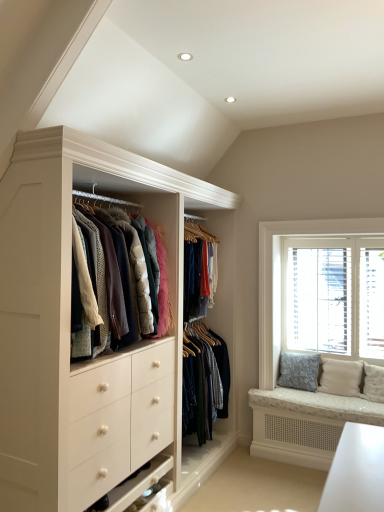
Question: Should I look upward or downward to see white wooden window at right?

Choices:
 (A) up
 (B) down

Answer: (B)

Question: Is white wooden window at right not within blue floral cushion at right, acting as the 2th pillow starting from the right?

Choices:
 (A) no
 (B) yes

Answer: (B)

Question: Can you confirm if white wooden window at right is bigger than blue floral cushion at right, which is the 1th pillow from left to right?

Choices:
 (A) no
 (B) yes

Answer: (B)

Question: Is white wooden window at right facing away from blue floral cushion at right, acting as the 2th pillow starting from the right?

Choices:
 (A) yes
 (B) no

Answer: (B)

Question: Considering the relative sizes of white wooden window at right and blue floral cushion at right, which is the 1th pillow from left to right, in the image provided, is white wooden window at right smaller than blue floral cushion at right, which is the 1th pillow from left to right,?

Choices:
 (A) no
 (B) yes

Answer: (A)

Question: From a real-world perspective, is white wooden window at right over blue floral cushion at right, which is the 1th pillow from left to right?

Choices:
 (A) no
 (B) yes

Answer: (B)

Question: Is there a large distance between white wooden window at right and blue floral cushion at right, acting as the 2th pillow starting from the right?

Choices:
 (A) yes
 (B) no

Answer: (B)

Question: Is blue floral cushion at right, which is the 1th pillow from left to right, further to camera compared to white wooden window at right?

Choices:
 (A) no
 (B) yes

Answer: (B)

Question: Are blue floral cushion at right, which is the 1th pillow from left to right, and white wooden window at right located far from each other?

Choices:
 (A) no
 (B) yes

Answer: (A)

Question: Could white wooden window at right be considered to be inside blue floral cushion at right, which is the 1th pillow from left to right?

Choices:
 (A) yes
 (B) no

Answer: (B)

Question: Considering the relative sizes of blue floral cushion at right, acting as the 2th pillow starting from the right, and white wooden window at right in the image provided, is blue floral cushion at right, acting as the 2th pillow starting from the right, wider than white wooden window at right?

Choices:
 (A) yes
 (B) no

Answer: (A)

Question: From a real-world perspective, is blue floral cushion at right, acting as the 2th pillow starting from the right, below white wooden window at right?

Choices:
 (A) no
 (B) yes

Answer: (B)

Question: Does blue floral cushion at right, which is the 1th pillow from left to right, have a lesser height compared to white wooden window at right?

Choices:
 (A) yes
 (B) no

Answer: (A)

Question: From a real-world perspective, is white wooden window at right physically below textured beige pillow at right, positioned as the 1th pillow in right-to-left order?

Choices:
 (A) no
 (B) yes

Answer: (A)